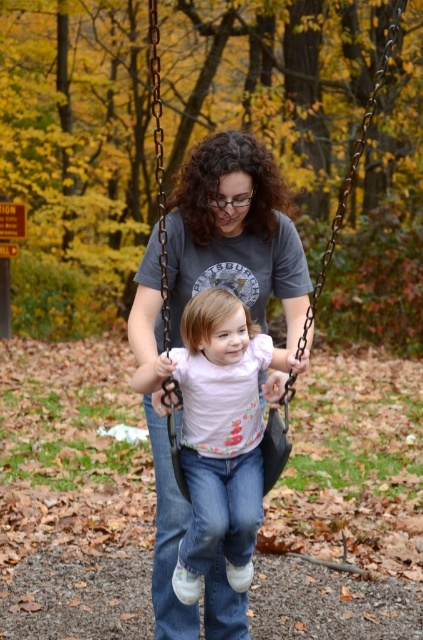
You are a photographer trying to capture a clear photo of the metallic chain swing at center without the gray cotton shirt at center blocking it. Based on the scene, where should you position yourself relative to the two objects?

Since the metallic chain swing at center is behind the gray cotton shirt at center, you should position yourself behind the metallic chain swing at center so that the gray cotton shirt at center is in front and the swing is visible behind it. Alternatively, moving to the side of the gray cotton shirt at center might allow you to frame the shot so the swing is not obscured.